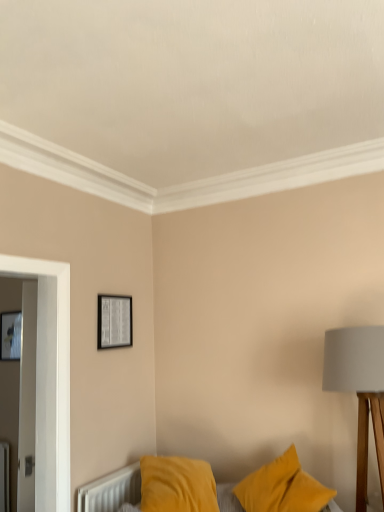
Question: Is the position of matte black picture frame at upper center, the second picture frame viewed from the back, less distant than that of matte gray fabric lampshade at right?

Choices:
 (A) no
 (B) yes

Answer: (A)

Question: Does matte black picture frame at upper center, the first picture frame positioned from the right, appear on the left side of matte gray fabric lampshade at right?

Choices:
 (A) yes
 (B) no

Answer: (A)

Question: From a real-world perspective, is matte black picture frame at upper center, the first picture frame positioned from the right, positioned over matte gray fabric lampshade at right based on gravity?

Choices:
 (A) yes
 (B) no

Answer: (A)

Question: Is matte gray fabric lampshade at right completely or partially inside matte black picture frame at upper center, the first picture frame positioned from the right?

Choices:
 (A) yes
 (B) no

Answer: (B)

Question: From the image's perspective, would you say matte black picture frame at upper center, the second picture frame viewed from the back, is shown under matte gray fabric lampshade at right?

Choices:
 (A) yes
 (B) no

Answer: (B)

Question: Considering the relative sizes of matte black picture frame at upper center, the second picture frame viewed from the back, and matte gray fabric lampshade at right in the image provided, is matte black picture frame at upper center, the second picture frame viewed from the back, thinner than matte gray fabric lampshade at right?

Choices:
 (A) no
 (B) yes

Answer: (B)

Question: Considering the relative sizes of matte black picture frame at upper left, which is counted as the 2th picture frame, starting from the front, and matte gray fabric lampshade at right in the image provided, is matte black picture frame at upper left, which is counted as the 2th picture frame, starting from the front, taller than matte gray fabric lampshade at right?

Choices:
 (A) no
 (B) yes

Answer: (A)

Question: Is matte black picture frame at upper left, the 2th picture frame viewed from the right, positioned in front of matte gray fabric lampshade at right?

Choices:
 (A) yes
 (B) no

Answer: (B)

Question: Could you tell me if matte black picture frame at upper left, the 1th picture frame from the left, is turned towards matte gray fabric lampshade at right?

Choices:
 (A) no
 (B) yes

Answer: (A)

Question: Is matte black picture frame at upper left, the 1th picture frame from the left, far away from matte gray fabric lampshade at right?

Choices:
 (A) yes
 (B) no

Answer: (A)

Question: From the image's perspective, does matte black picture frame at upper left, the 2th picture frame viewed from the right, appear higher than matte gray fabric lampshade at right?

Choices:
 (A) yes
 (B) no

Answer: (A)

Question: Does matte black picture frame at upper left, which is counted as the 2th picture frame, starting from the front, appear on the left side of matte gray fabric lampshade at right?

Choices:
 (A) yes
 (B) no

Answer: (A)

Question: Can you confirm if matte black picture frame at upper left, the 1th picture frame from the left, is positioned to the left of matte black picture frame at upper center, the first picture frame positioned from the right?

Choices:
 (A) no
 (B) yes

Answer: (B)